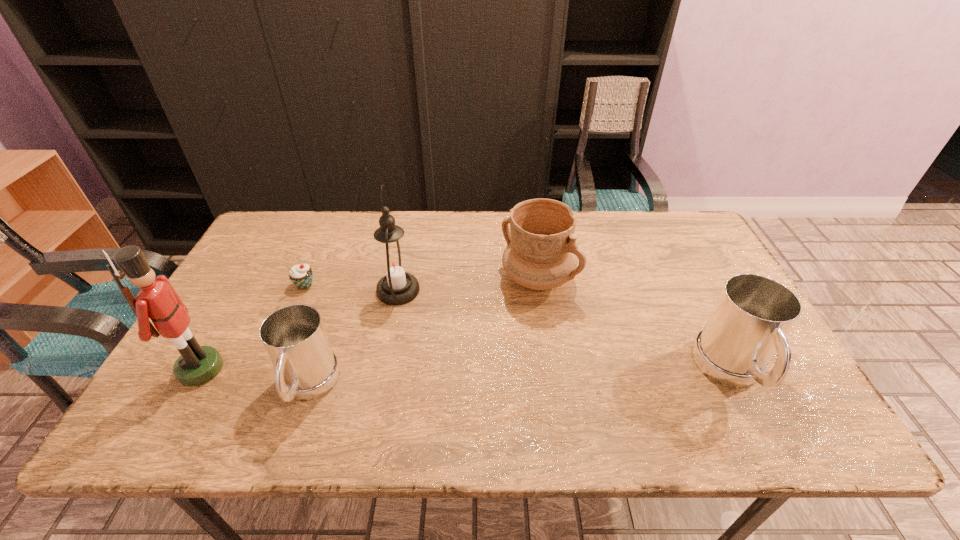
To make them evenly spaced by inserting another mug among them, please locate a free space for this new mug. Please provide its 2D coordinates. Your answer should be formatted as a tuple, i.e. [(x, y)], where the tuple contains the x and y coordinates of a point satisfying the conditions above.

[(523, 380)]